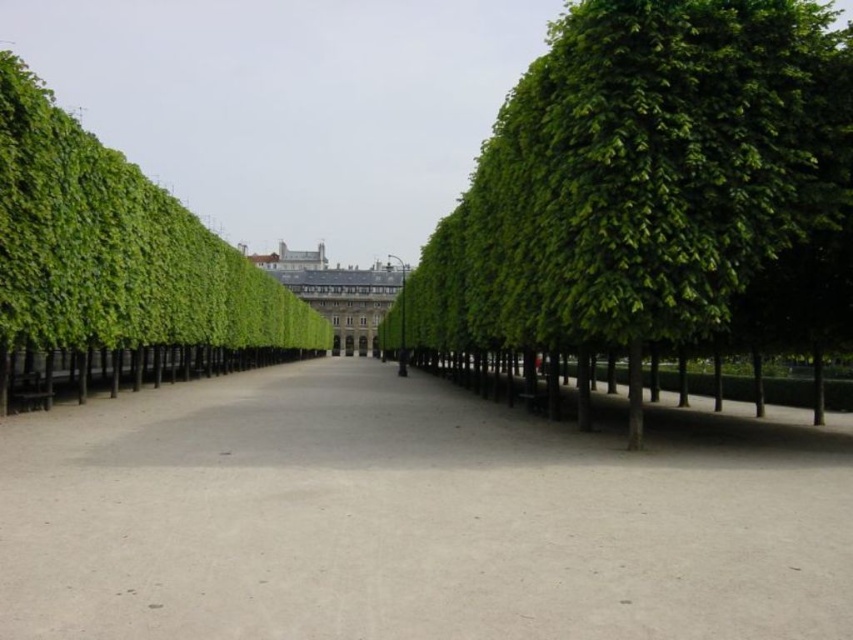
Is green leafy bush at left above white stone building at center?

Incorrect, green leafy bush at left is not positioned above white stone building at center.

Is green leafy bush at left to the right of white stone building at center from the viewer's perspective?

No, green leafy bush at left is not to the right of white stone building at center.

Which is behind, point (120, 304) or point (352, 348)?

Positioned behind is point (352, 348).

Where is `green leafy bush at left`? green leafy bush at left is located at coordinates (115, 268).

Between point (573, 182) and point (370, 332), which one is positioned behind?

Point (370, 332)

Does point (724, 172) lie behind point (352, 326)?

That is False.

You are a GUI agent. You are given a task and a screenshot of the screen. Output one action in this format:
    pyautogui.click(x=<x>, y=<y>)
    Task: Click on the green leafy tree at center
    The width and height of the screenshot is (853, 640).
    Given the screenshot: What is the action you would take?
    [648, 188]

Locate an element on the screen. This screenshot has width=853, height=640. green leafy tree at center is located at coordinates (648, 188).

Who is positioned more to the left, gray concrete alley at center or green leafy tree at center?

Positioned to the left is gray concrete alley at center.

Locate an element on the screen. The width and height of the screenshot is (853, 640). gray concrete alley at center is located at coordinates (407, 518).

Locate an element on the screen. Image resolution: width=853 pixels, height=640 pixels. gray concrete alley at center is located at coordinates (407, 518).